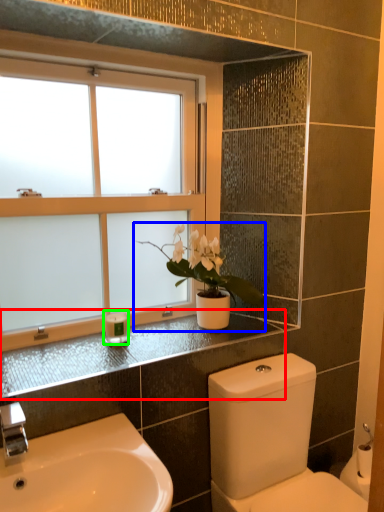
Question: Based on their relative distances, which object is farther from counter top (highlighted by a red box)? Choose from houseplant (highlighted by a blue box) and toiletry (highlighted by a green box).

Choices:
 (A) houseplant
 (B) toiletry

Answer: (A)